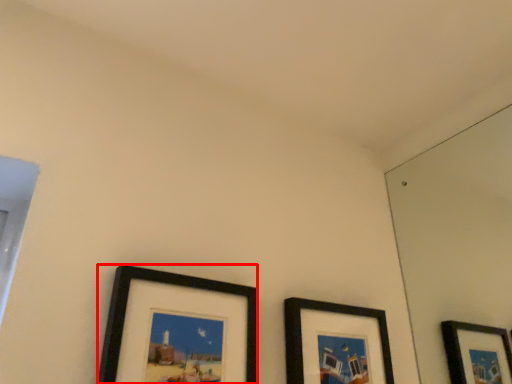
Question: From the image's perspective, what is the correct spatial positioning of picture frame (annotated by the red box) in reference to picture frame?

Choices:
 (A) above
 (B) below

Answer: (A)